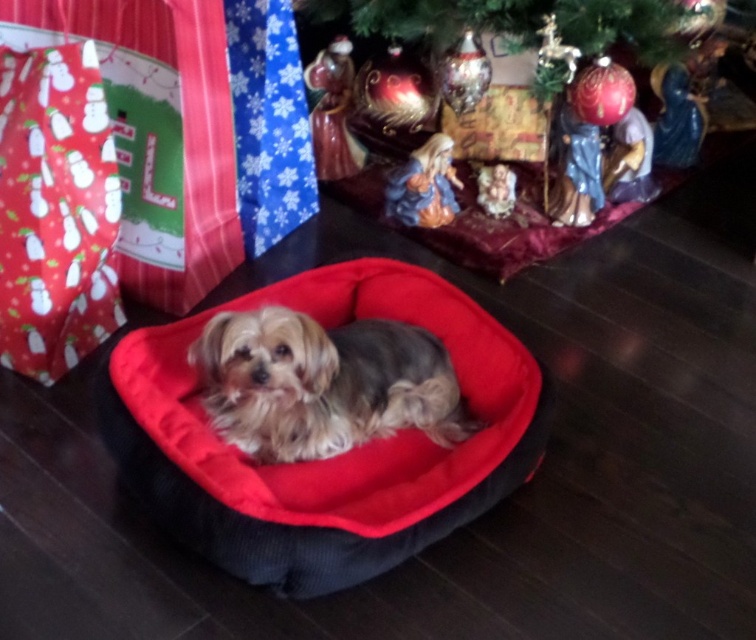
You are a guest at a party and want to take a photo of the soft fur dog at center and the shiny green christmas tree at upper center. Which object should you focus on first if you want to capture both in the same frame?

The soft fur dog at center is located below the shiny green christmas tree at upper center, so you should focus on the shiny green christmas tree at upper center first to ensure both are in the frame.

You are standing in the room and see two points marked in the image. Which point is closer to you, point [256,362] or point [420,36]?

Point [256,362] is closer to the viewer than point [420,36].